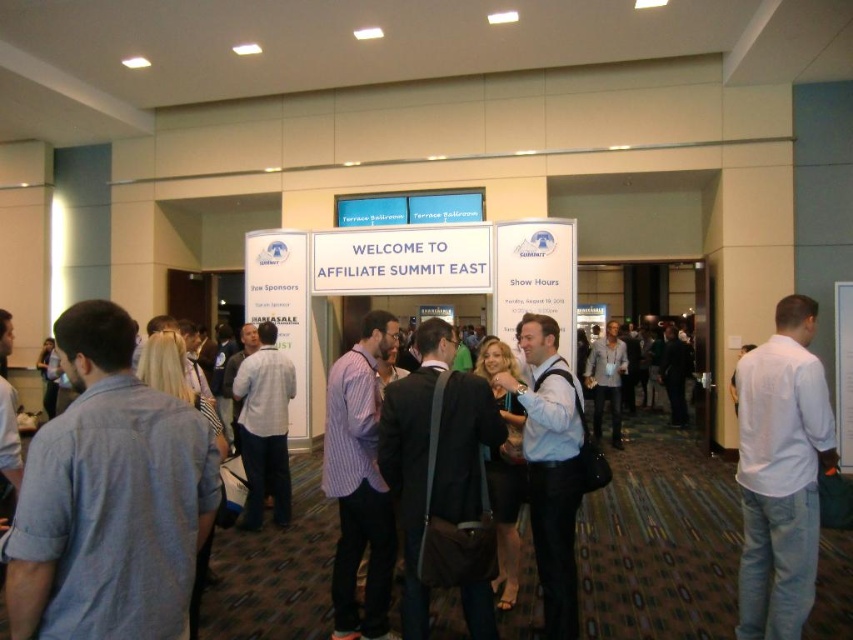
Looking at this image, you are an event organizer at the AFFILIATE SUMMIT EAST. You need to ensure that the two attendees wearing the light blue cotton shirt at left and white cotton shirt at right can hear the announcements clearly. The minimum distance required for clear audio is 8 feet. Can both attendees hear the announcement without moving?

The light blue cotton shirt at left is 9.02 feet from the white cotton shirt at right. Since the distance between them is greater than 8 feet, both attendees are within the required distance to hear the announcement clearly.

You are standing at the entrance of the AFFILIATE SUMMIT EAST event and need to locate two specific points marked on the floor. The first point is at coordinates point (86,332) and the second is at point (799,314). Which point is closer to you?

Point (86,332) is closer to the viewer than point (799,314).